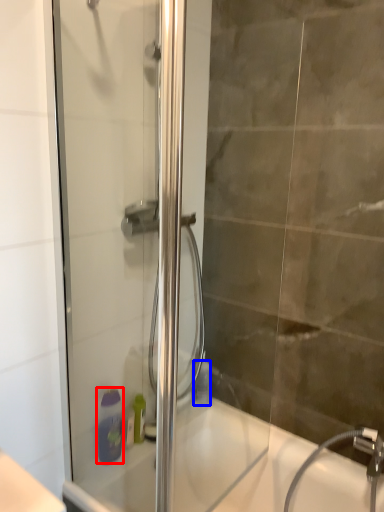
Question: Which of the following is the farthest to the observer, soap dispenser (highlighted by a red box) or toiletry (highlighted by a blue box)?

Choices:
 (A) soap dispenser
 (B) toiletry

Answer: (B)